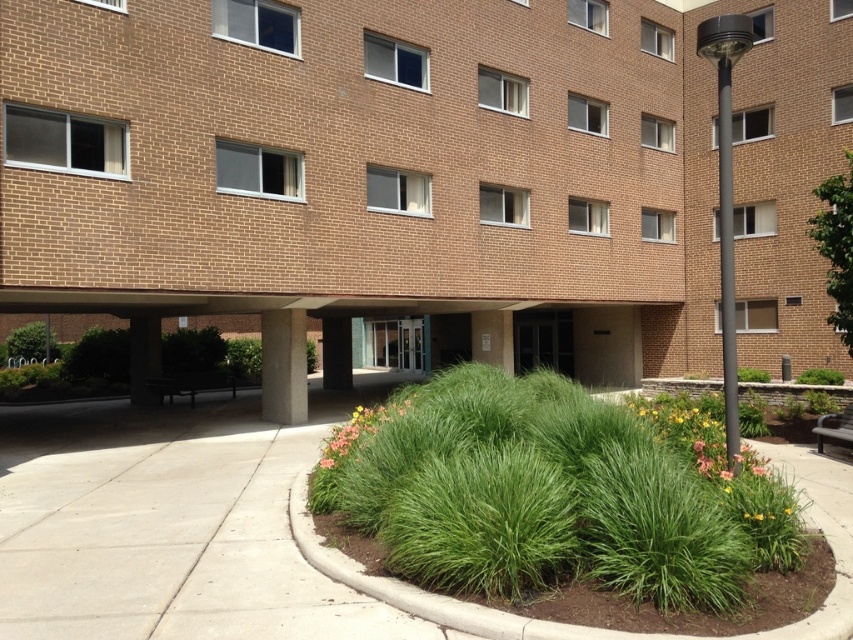
You are standing at the point labeled as point (335, 353) in the image. What object are you directly facing?

You are directly facing the brown concrete pillar at center indicated by point (335, 353).

You are a gardener planning to plant a new shrub that requires a space of at least 1.2 meters in width. You see the green grassy bush at lower left and the green grassy bush at center. Which of these bushes would be suitable for planting the new shrub next to, considering their sizes?

The green grassy bush at lower left is larger in size than the green grassy bush at center. Since the new shrub requires at least 1.2 meters in width, the larger bush at lower left likely has enough space to accommodate it.

You are standing at the entrance of the building and want to walk towards the green grassy bush at center. Which direction should you move relative to the brown concrete pillar at center?

You should move to the right of the brown concrete pillar at center to reach the green grassy bush at center because the brown concrete pillar at center is located to the left of the green grassy bush at center.